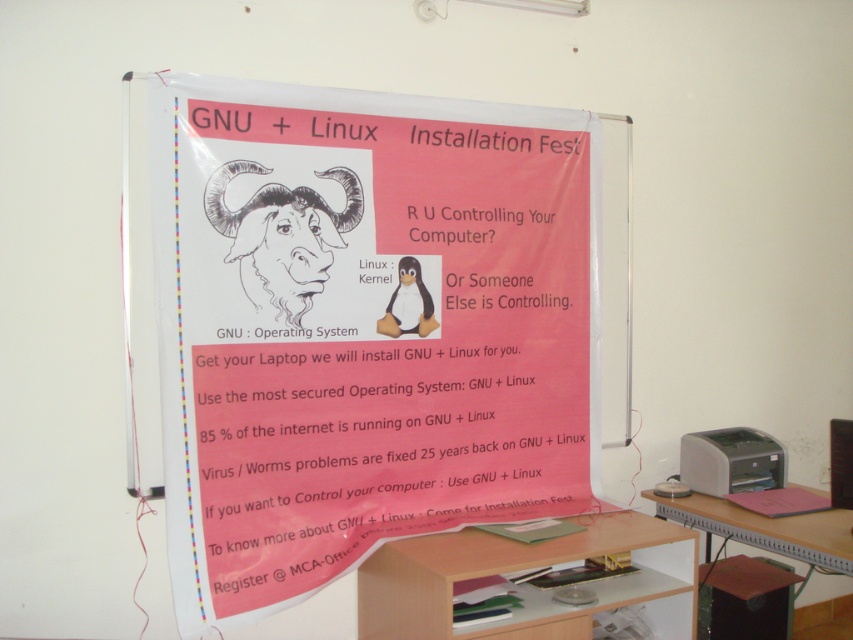
Question: Which of these objects is positioned farthest from the wooden desk at lower right?

Choices:
 (A) white plastic printer at lower right
 (B) brown wood computer desk at center
 (C) pink paper poster at center
 (D) black line drawing goat at center

Answer: (D)

Question: Which object is the farthest from the wooden desk at lower right?

Choices:
 (A) black line drawing goat at center
 (B) white plastic printer at lower right

Answer: (A)

Question: Estimate the real-world distances between objects in this image. Which object is closer to the black line drawing goat at center?

Choices:
 (A) white plastic printer at lower right
 (B) wooden desk at lower right

Answer: (B)

Question: In this image, where is wooden desk at lower right located relative to white plastic printer at lower right?

Choices:
 (A) right
 (B) left

Answer: (A)

Question: Does black line drawing goat at center have a greater width compared to wooden desk at lower right?

Choices:
 (A) no
 (B) yes

Answer: (A)

Question: Is black line drawing goat at center thinner than white plastic printer at lower right?

Choices:
 (A) yes
 (B) no

Answer: (B)